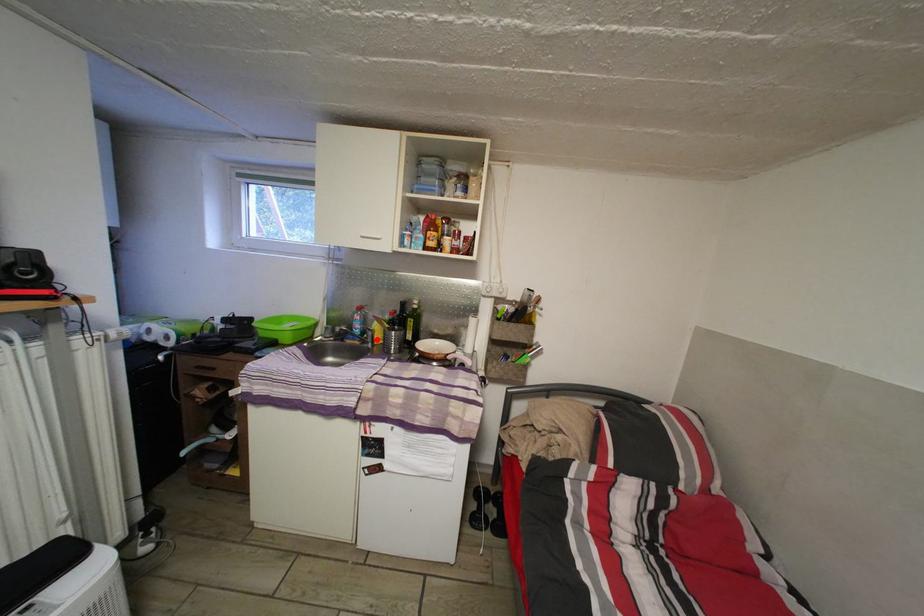
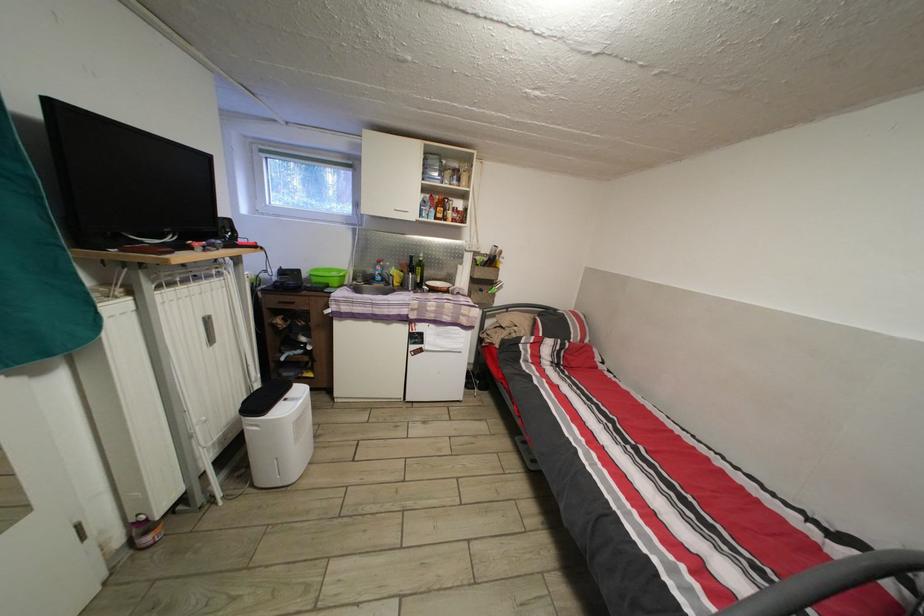
Question: I am providing you with two images of the same scene from different viewpoints. In image1, a red point is highlighted. Considering the same 3D point in image2, which of the following is correct?

Choices:
 (A) It is closer
 (B) It is farther

Answer: (A)